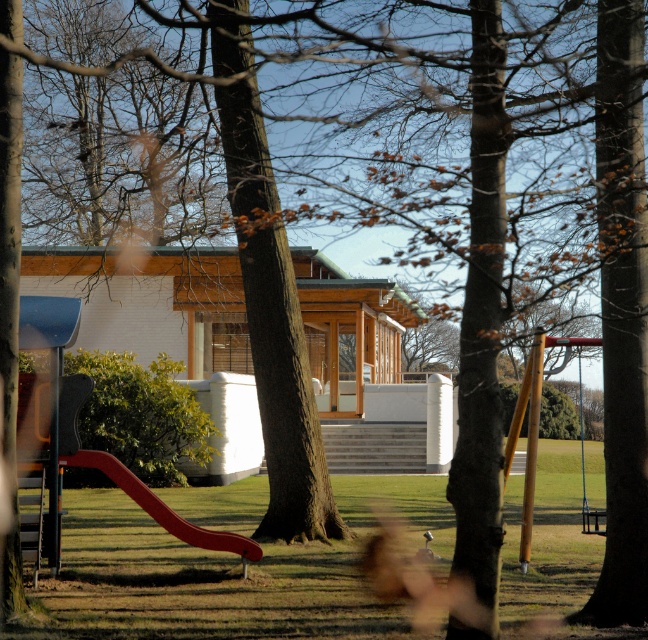
Who is shorter, red plastic slide at lower left or metallic silver swing at right?

With less height is red plastic slide at lower left.

Is red plastic slide at lower left to the left of metallic silver swing at right from the viewer's perspective?

Correct, you'll find red plastic slide at lower left to the left of metallic silver swing at right.

Measure the distance between red plastic slide at lower left and camera.

red plastic slide at lower left and camera are 14.21 meters apart.

Where is `red plastic slide at lower left`? red plastic slide at lower left is located at coordinates (163, 506).